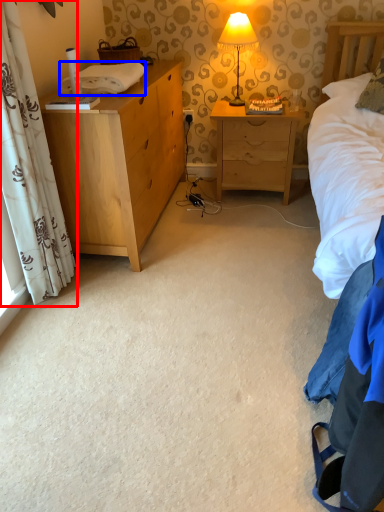
Question: Which object is further to the camera taking this photo, curtain (highlighted by a red box) or cloth (highlighted by a blue box)?

Choices:
 (A) curtain
 (B) cloth

Answer: (B)